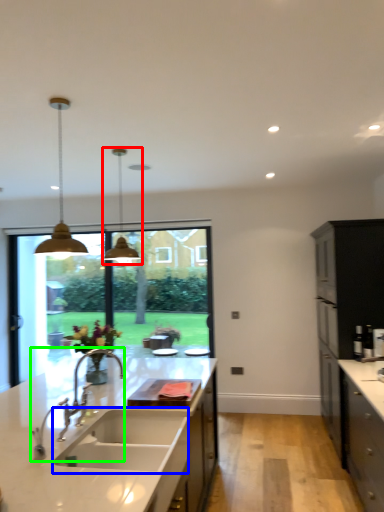
Question: Which object is positioned closest to light fixture (highlighted by a red box)? Select from sink (highlighted by a blue box) and tap (highlighted by a green box).

Choices:
 (A) sink
 (B) tap

Answer: (B)